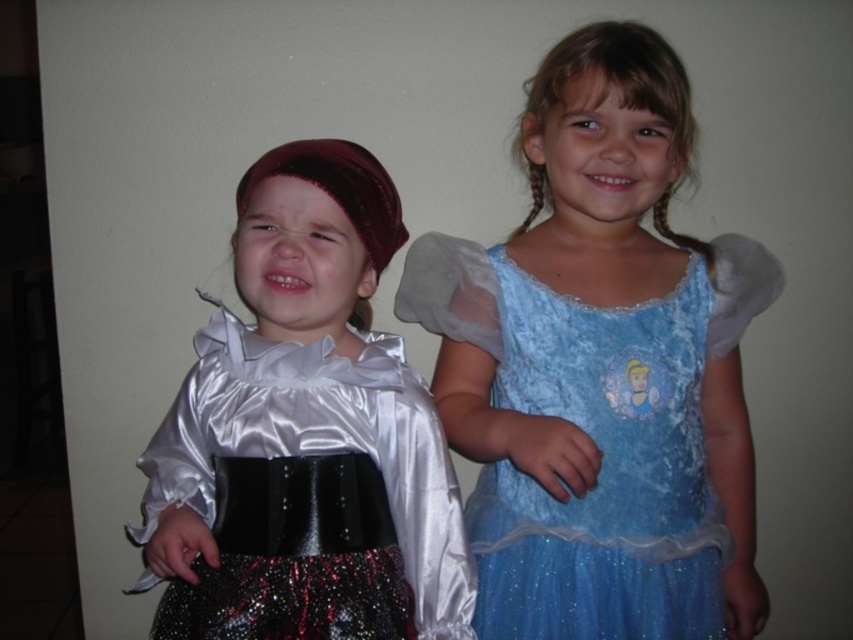
Question: Observing the image, what is the correct spatial positioning of blue velvet dress at center in reference to satin dress at left?

Choices:
 (A) right
 (B) left

Answer: (A)

Question: Which point appears farthest from the camera in this image?

Choices:
 (A) (410, 502)
 (B) (630, 257)

Answer: (B)

Question: Is blue velvet dress at center to the right of satin dress at left from the viewer's perspective?

Choices:
 (A) no
 (B) yes

Answer: (B)

Question: Is the position of blue velvet dress at center less distant than that of satin dress at left?

Choices:
 (A) yes
 (B) no

Answer: (A)

Question: Which object appears farthest from the camera in this image?

Choices:
 (A) blue velvet dress at center
 (B) satin dress at left

Answer: (B)

Question: Which point appears farthest from the camera in this image?

Choices:
 (A) (695, 458)
 (B) (450, 620)

Answer: (A)